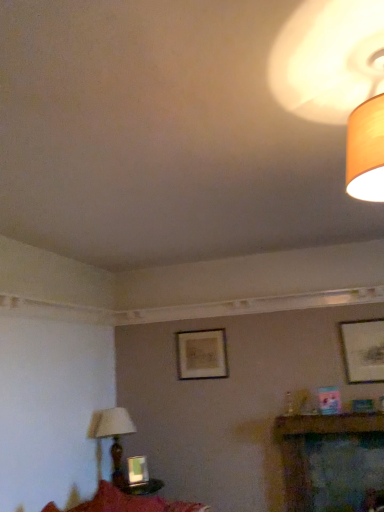
Question: Is the position of metallic silver picture frame at lower center, which is the second picture frame from back to front, more distant than that of wooden lampshade at lower left, which is counted as the second lamp, starting from the right?

Choices:
 (A) no
 (B) yes

Answer: (B)

Question: From the image's perspective, is metallic silver picture frame at lower center, which is counted as the 1th picture frame, starting from the bottom, under wooden lampshade at lower left, the second lamp positioned from the top?

Choices:
 (A) no
 (B) yes

Answer: (B)

Question: Is metallic silver picture frame at lower center, which is the second picture frame from front to back, outside wooden lampshade at lower left, which is counted as the second lamp, starting from the right?

Choices:
 (A) yes
 (B) no

Answer: (A)

Question: Does metallic silver picture frame at lower center, which ranks as the first picture frame in left-to-right order, have a greater width compared to wooden lampshade at lower left, which appears as the first lamp when viewed from the back?

Choices:
 (A) yes
 (B) no

Answer: (B)

Question: Is wooden lampshade at lower left, the second lamp positioned from the top, at the back of metallic silver picture frame at lower center, the 3th picture frame viewed from the top?

Choices:
 (A) yes
 (B) no

Answer: (B)

Question: Can you confirm if metallic silver picture frame at lower center, the third picture frame when ordered from right to left, is taller than wooden lampshade at lower left, which appears as the 2th lamp when viewed from the front?

Choices:
 (A) yes
 (B) no

Answer: (B)

Question: From the image's perspective, is wooden lampshade at lower left, which is counted as the second lamp, starting from the right, above metallic silver picture frame at lower center, which is the second picture frame from front to back?

Choices:
 (A) no
 (B) yes

Answer: (B)

Question: Can you confirm if wooden lampshade at lower left, which appears as the 2th lamp when viewed from the front, is bigger than metallic silver picture frame at lower center, which ranks as the first picture frame in left-to-right order?

Choices:
 (A) no
 (B) yes

Answer: (B)

Question: Is wooden lampshade at lower left, which ranks as the 1th lamp in left-to-right order, far away from metallic silver picture frame at lower center, which ranks as the first picture frame in left-to-right order?

Choices:
 (A) yes
 (B) no

Answer: (B)

Question: Is wooden lampshade at lower left, which ranks as the 1th lamp in left-to-right order, facing away from metallic silver picture frame at lower center, which is the second picture frame from front to back?

Choices:
 (A) no
 (B) yes

Answer: (A)

Question: Considering the relative positions of wooden lampshade at lower left, the second lamp positioned from the top, and metallic silver picture frame at lower center, which is the second picture frame from back to front, in the image provided, is wooden lampshade at lower left, the second lamp positioned from the top, behind metallic silver picture frame at lower center, which is the second picture frame from back to front,?

Choices:
 (A) no
 (B) yes

Answer: (A)

Question: Is wooden lampshade at lower left, which appears as the 2th lamp when viewed from the front, thinner than metallic silver picture frame at lower center, which is the second picture frame from front to back?

Choices:
 (A) no
 (B) yes

Answer: (A)

Question: Can you confirm if matte wooden picture frame at center, arranged as the 2th picture frame when viewed from the top, is shorter than matte black picture frame at upper right, the first picture frame when ordered from top to bottom?

Choices:
 (A) no
 (B) yes

Answer: (B)